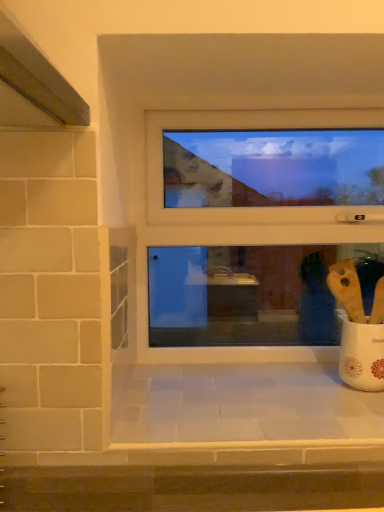
Where is `vacant point above white glossy window at center (from a real-world perspective)`? This screenshot has height=512, width=384. vacant point above white glossy window at center (from a real-world perspective) is located at coordinates (296, 90).